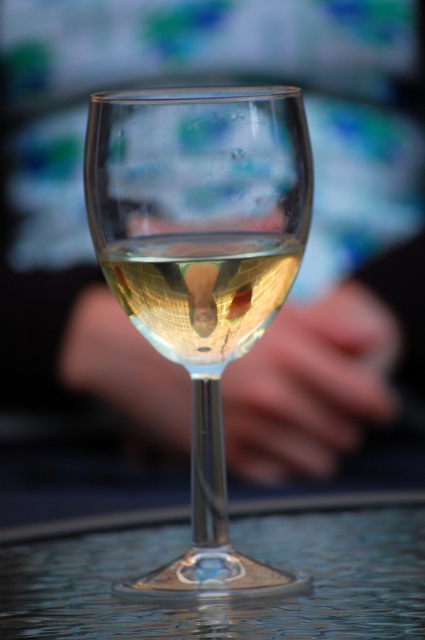
Question: Does transparent glass wine glass at center lie in front of transparent glass at center?

Choices:
 (A) yes
 (B) no

Answer: (B)

Question: Does transparent glass at center appear under clear glass wine at center?

Choices:
 (A) yes
 (B) no

Answer: (A)

Question: Which of the following is the closest to the observer?

Choices:
 (A) transparent glass at center
 (B) transparent glass wine glass at center
 (C) clear glass wine at center

Answer: (A)

Question: Considering the relative positions of transparent glass wine glass at center and transparent glass at center in the image provided, where is transparent glass wine glass at center located with respect to transparent glass at center?

Choices:
 (A) above
 (B) below

Answer: (A)

Question: Which object is the closest to the transparent glass at center?

Choices:
 (A) transparent glass wine glass at center
 (B) clear glass wine at center

Answer: (A)

Question: Which is farther from the clear glass wine at center?

Choices:
 (A) transparent glass at center
 (B) transparent glass wine glass at center

Answer: (A)